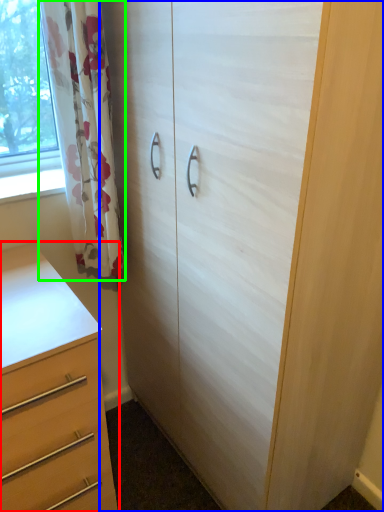
Question: Considering the real-world distances, which object is farthest from chest of drawers (highlighted by a red box)? cupboard (highlighted by a blue box) or curtain (highlighted by a green box)?

Choices:
 (A) cupboard
 (B) curtain

Answer: (A)